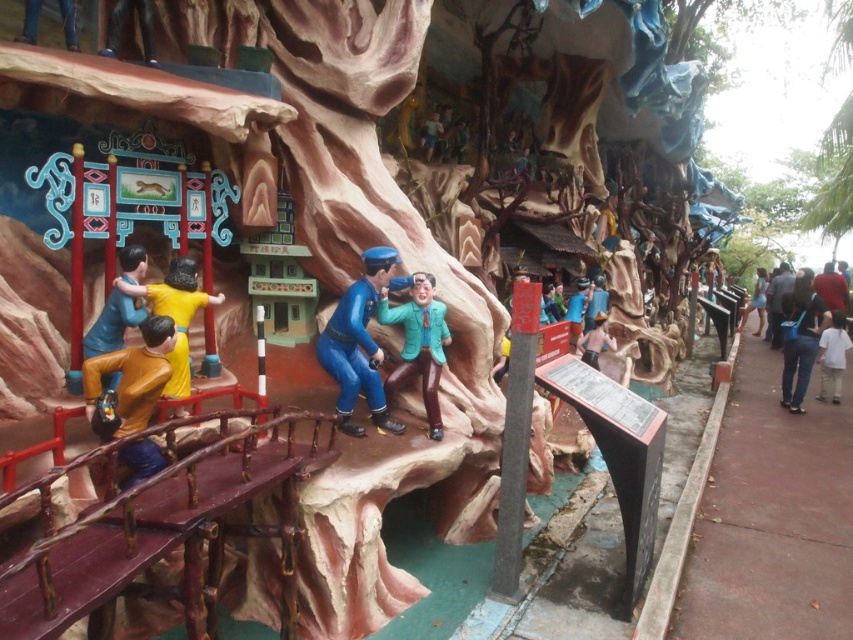
You are a visitor standing in front of the diorama and want to take a photo of both the blue glossy uniform at center and the yellow matte figure at center. Which one will appear larger in your photo?

The blue glossy uniform at center will appear larger in the photo because it is closer to the viewer than the yellow matte figure at center.

You are standing in the themed park diorama and want to take a photo of both the jeans at right and the dark blue uniform at right. Which one should you focus on first to ensure both are in clear view?

You should focus on the jeans at right first because it is closer to the viewer than the dark blue uniform at right, ensuring both will be in clear view when focused on the closer object.